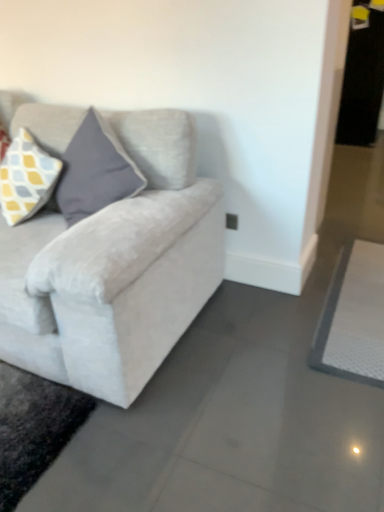
Question: From a real-world perspective, does velvet light gray couch at left stand above white textured yoga mat at lower right?

Choices:
 (A) no
 (B) yes

Answer: (B)

Question: From the image's perspective, is velvet light gray couch at left located above white textured yoga mat at lower right?

Choices:
 (A) no
 (B) yes

Answer: (B)

Question: Would you say white textured yoga mat at lower right is part of velvet light gray couch at left's contents?

Choices:
 (A) yes
 (B) no

Answer: (B)

Question: Considering the relative sizes of velvet light gray couch at left and white textured yoga mat at lower right in the image provided, is velvet light gray couch at left smaller than white textured yoga mat at lower right?

Choices:
 (A) yes
 (B) no

Answer: (B)

Question: Would you say velvet light gray couch at left is a long distance from white textured yoga mat at lower right?

Choices:
 (A) yes
 (B) no

Answer: (B)

Question: Is white textured yoga mat at lower right to the left or to the right of yellow and gray checkered fabric pillow at upper left in the image?

Choices:
 (A) right
 (B) left

Answer: (A)

Question: From the image's perspective, is white textured yoga mat at lower right positioned above or below yellow and gray checkered fabric pillow at upper left?

Choices:
 (A) above
 (B) below

Answer: (B)

Question: In terms of width, does white textured yoga mat at lower right look wider or thinner when compared to yellow and gray checkered fabric pillow at upper left?

Choices:
 (A) thin
 (B) wide

Answer: (B)

Question: From a real-world perspective, is white textured yoga mat at lower right positioned above or below yellow and gray checkered fabric pillow at upper left?

Choices:
 (A) above
 (B) below

Answer: (B)

Question: Is velvet light gray couch at left taller or shorter than yellow and gray checkered fabric pillow at upper left?

Choices:
 (A) short
 (B) tall

Answer: (B)

Question: Is velvet light gray couch at left wider or thinner than yellow and gray checkered fabric pillow at upper left?

Choices:
 (A) thin
 (B) wide

Answer: (B)

Question: In terms of size, does velvet light gray couch at left appear bigger or smaller than yellow and gray checkered fabric pillow at upper left?

Choices:
 (A) small
 (B) big

Answer: (B)

Question: From a real-world perspective, relative to yellow and gray checkered fabric pillow at upper left, is velvet light gray couch at left vertically above or below?

Choices:
 (A) above
 (B) below

Answer: (B)

Question: Is yellow and gray checkered fabric pillow at upper left in front of or behind white textured yoga mat at lower right in the image?

Choices:
 (A) behind
 (B) front

Answer: (A)

Question: Considering the positions of yellow and gray checkered fabric pillow at upper left and white textured yoga mat at lower right in the image, is yellow and gray checkered fabric pillow at upper left taller or shorter than white textured yoga mat at lower right?

Choices:
 (A) tall
 (B) short

Answer: (A)